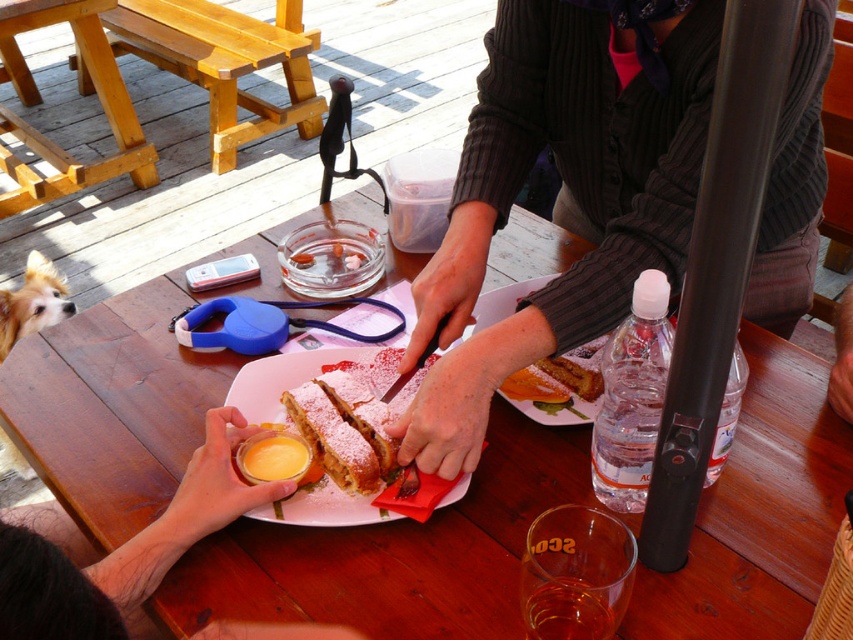
Between fuzzy brown dog at lower left and golden brown cake at center, which one is positioned lower?

fuzzy brown dog at lower left

Does fuzzy brown dog at lower left come behind golden brown cake at center?

→ Yes, it is.

The width and height of the screenshot is (853, 640). Identify the location of fuzzy brown dog at lower left. (32, 301).

Is fuzzy brown dog at lower left thinner than brown fur dog at lower left?

No.

Which is below, fuzzy brown dog at lower left or brown fur dog at lower left?

fuzzy brown dog at lower left is lower down.

Who is more forward, (36, 253) or (22, 317)?

Point (22, 317) is in front.

I want to click on fuzzy brown dog at lower left, so click(32, 301).

Does powdered sugar pastry at center appear over brown fur dog at lower left?

Actually, powdered sugar pastry at center is below brown fur dog at lower left.

Does powdered sugar pastry at center appear under brown fur dog at lower left?

Yes.

The image size is (853, 640). I want to click on powdered sugar pastry at center, so pos(352,413).